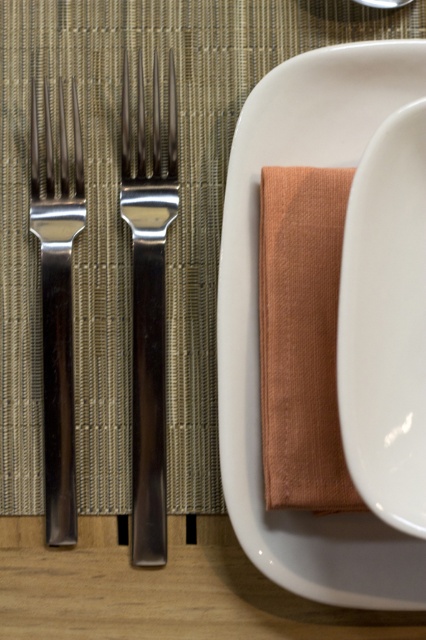
Question: Which object is farther from the camera taking this photo?

Choices:
 (A) polished silver fork at left
 (B) white matte platter at center
 (C) white glossy plate at upper right

Answer: (A)

Question: Is white matte platter at center thinner than white glossy plate at upper right?

Choices:
 (A) no
 (B) yes

Answer: (A)

Question: Considering the relative positions of polished silver fork at center and polished silver fork at left in the image provided, where is polished silver fork at center located with respect to polished silver fork at left?

Choices:
 (A) above
 (B) below

Answer: (A)

Question: Among these objects, which one is farthest from the camera?

Choices:
 (A) white glossy plate at upper right
 (B) white matte platter at center
 (C) polished silver fork at center
 (D) polished silver fork at left

Answer: (C)

Question: Does white glossy plate at upper right appear under polished silver fork at center?

Choices:
 (A) no
 (B) yes

Answer: (B)

Question: Which object is farther from the camera taking this photo?

Choices:
 (A) polished silver fork at center
 (B) white matte platter at center
 (C) polished silver fork at left
 (D) white glossy plate at upper right

Answer: (A)